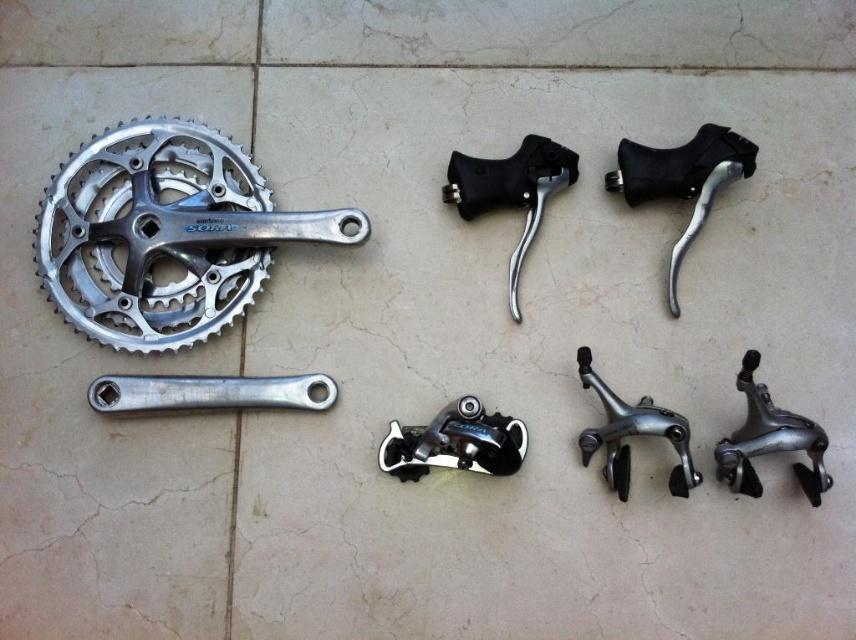
You are a GUI agent. You are given a task and a screenshot of the screen. Output one action in this format:
    pyautogui.click(x=<x>, y=<y>)
    Task: Click on the silver metallic gear at upper left
    
    Given the screenshot: What is the action you would take?
    pyautogui.click(x=165, y=234)

Looking at this image, can you confirm if silver metallic gear at upper left is smaller than silver metallic brake at lower right?

No, silver metallic gear at upper left is not smaller than silver metallic brake at lower right.

Who is more forward, (209,252) or (722,452)?

Positioned in front is point (722,452).

Locate an element on the screen. silver metallic gear at upper left is located at coordinates (165, 234).

Is silver metallic crank arm at lower left wider than silver metallic brake at lower right?

Indeed, silver metallic crank arm at lower left has a greater width compared to silver metallic brake at lower right.

Is point (195, 378) more distant than point (811, 460)?

Yes.

This screenshot has width=856, height=640. What do you see at coordinates (210, 392) in the screenshot?
I see `silver metallic crank arm at lower left` at bounding box center [210, 392].

The width and height of the screenshot is (856, 640). I want to click on silver metallic crank arm at lower left, so click(x=210, y=392).

Image resolution: width=856 pixels, height=640 pixels. I want to click on black rubber brake lever at upper right, so click(681, 179).